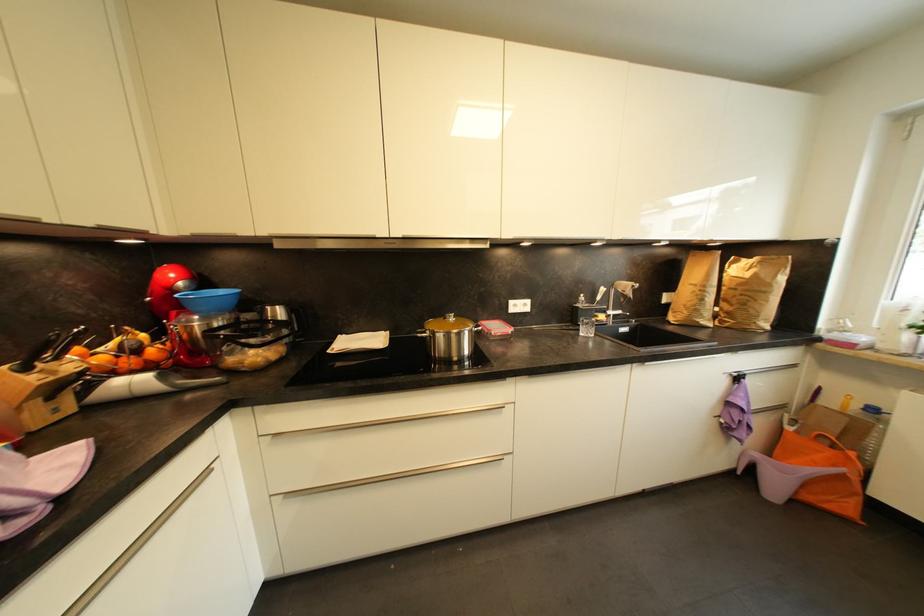
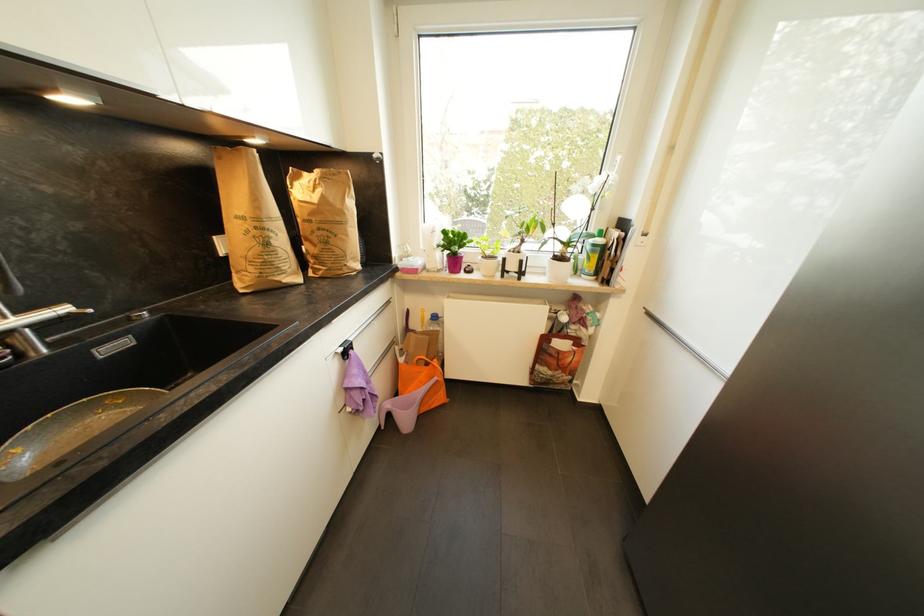
Find the pixel in the second image that matches (744,286) in the first image.

(317, 216)